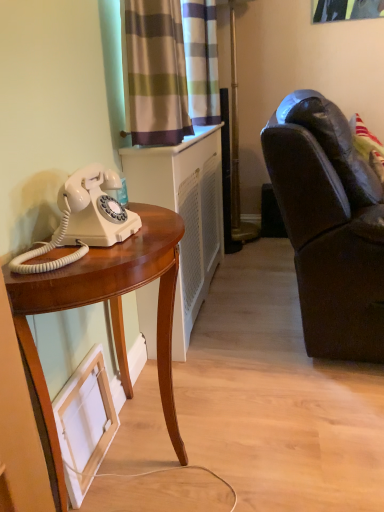
Question: Considering the relative sizes of white plastic radiator at center and white matte picture frame at lower left in the image provided, is white plastic radiator at center smaller than white matte picture frame at lower left?

Choices:
 (A) yes
 (B) no

Answer: (B)

Question: From a real-world perspective, is white plastic radiator at center positioned under white matte picture frame at lower left based on gravity?

Choices:
 (A) no
 (B) yes

Answer: (A)

Question: Can you confirm if white plastic radiator at center is bigger than white matte picture frame at lower left?

Choices:
 (A) yes
 (B) no

Answer: (A)

Question: Considering the relative positions of white plastic radiator at center and white matte picture frame at lower left in the image provided, is white plastic radiator at center to the right of white matte picture frame at lower left from the viewer's perspective?

Choices:
 (A) yes
 (B) no

Answer: (A)

Question: From a real-world perspective, is white plastic radiator at center over white matte picture frame at lower left?

Choices:
 (A) yes
 (B) no

Answer: (A)

Question: In terms of width, does striped fabric curtain at upper center, positioned as the second curtain in back-to-front order, look wider or thinner when compared to mahogany wood desk at left?

Choices:
 (A) wide
 (B) thin

Answer: (B)

Question: Is point (188, 82) closer or farther from the camera than point (36, 404)?

Choices:
 (A) farther
 (B) closer

Answer: (A)

Question: From the image's perspective, is striped fabric curtain at upper center, acting as the first curtain starting from the front, above or below mahogany wood desk at left?

Choices:
 (A) above
 (B) below

Answer: (A)

Question: Is striped fabric curtain at upper center, acting as the first curtain starting from the front, taller or shorter than mahogany wood desk at left?

Choices:
 (A) short
 (B) tall

Answer: (A)

Question: Is white matte picture frame at lower left bigger or smaller than mahogany wood desk at left?

Choices:
 (A) small
 (B) big

Answer: (A)

Question: From a real-world perspective, relative to mahogany wood desk at left, is white matte picture frame at lower left vertically above or below?

Choices:
 (A) above
 (B) below

Answer: (B)

Question: Is white matte picture frame at lower left taller or shorter than mahogany wood desk at left?

Choices:
 (A) short
 (B) tall

Answer: (A)

Question: Do you think white matte picture frame at lower left is within mahogany wood desk at left, or outside of it?

Choices:
 (A) outside
 (B) inside

Answer: (B)

Question: Is point (314, 331) positioned closer to the camera than point (86, 451)?

Choices:
 (A) closer
 (B) farther

Answer: (B)

Question: Choose the correct answer: Is dark brown leather couch at right inside white matte picture frame at lower left or outside it?

Choices:
 (A) inside
 (B) outside

Answer: (B)